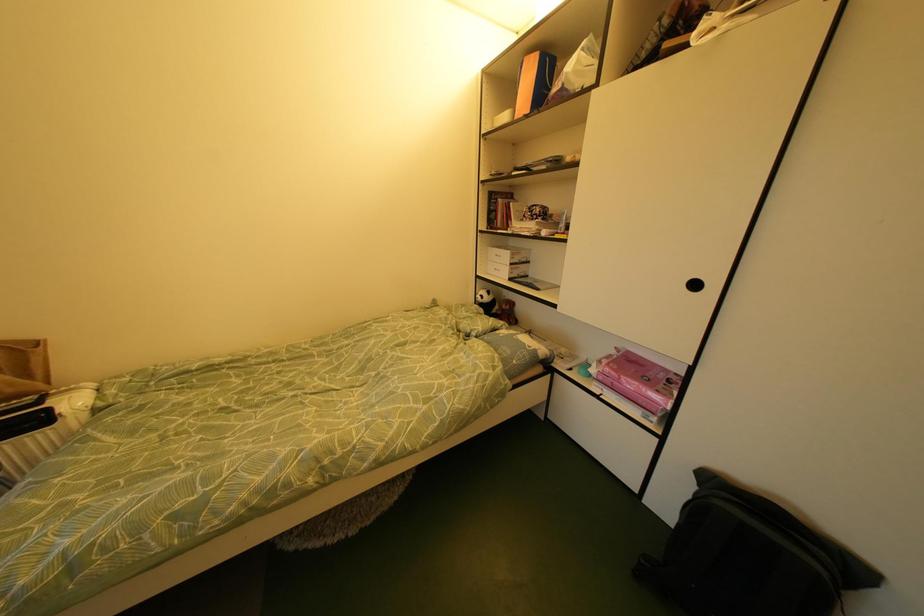
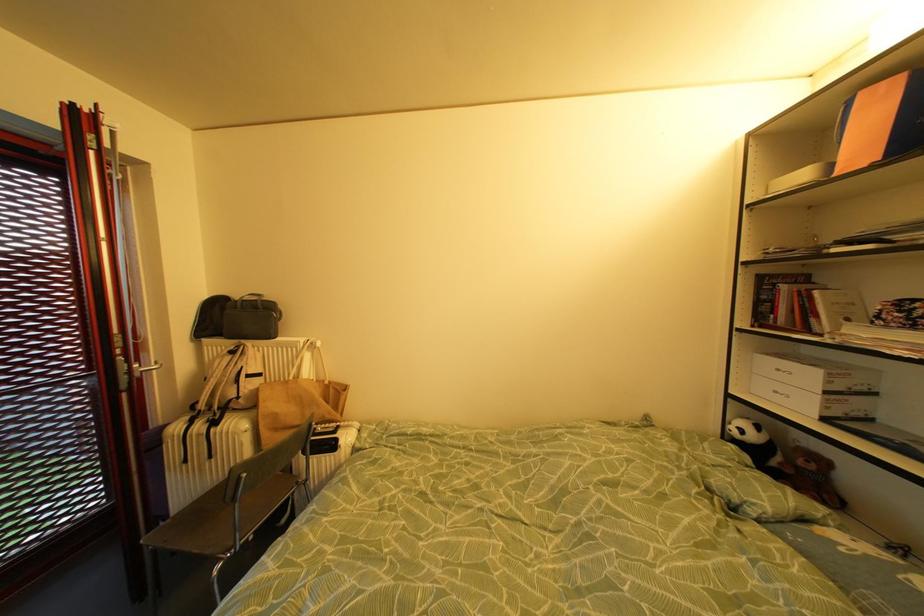
Question: Based on the continuous images, in which direction is the camera rotating? Reply with the corresponding letter.

Choices:
 (A) Left
 (B) Right
 (C) Up
 (D) Down

Answer: (A)